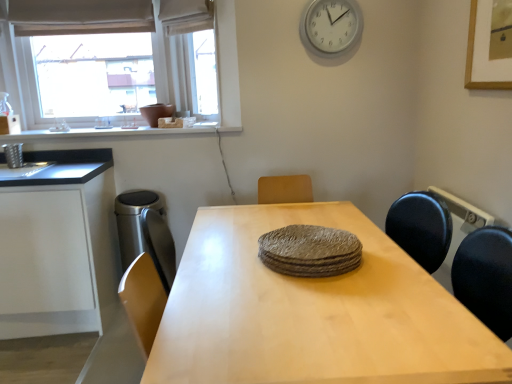
What are the coordinates of `free space to the left of textured gray plates at center` in the screenshot? It's located at (207, 264).